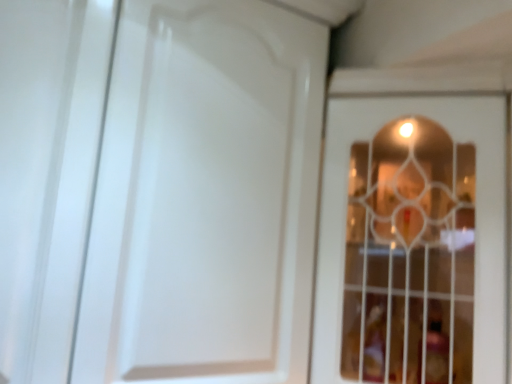
Question: In which direction should I rotate to look at white glossy door at center, the 1th door from the left?

Choices:
 (A) right
 (B) left

Answer: (B)

Question: Considering the relative sizes of white glossy door at center, which is the second door from right to left, and white glass door at center, the first door positioned from the right, in the image provided, is white glossy door at center, which is the second door from right to left, bigger than white glass door at center, the first door positioned from the right,?

Choices:
 (A) yes
 (B) no

Answer: (A)

Question: Is white glossy door at center, which is the second door from right to left, surrounding white glass door at center, the 2th door from the left?

Choices:
 (A) yes
 (B) no

Answer: (B)

Question: Is white glass door at center, the 2th door from the left, at the back of white glossy door at center, which is the second door from right to left?

Choices:
 (A) no
 (B) yes

Answer: (A)

Question: Is the position of white glossy door at center, the 1th door from the left, more distant than that of white glass door at center, the first door positioned from the right?

Choices:
 (A) yes
 (B) no

Answer: (A)

Question: From a real-world perspective, is white glossy door at center, which is the second door from right to left, over white glass door at center, the 2th door from the left?

Choices:
 (A) no
 (B) yes

Answer: (B)

Question: Is white glossy door at center, which is the second door from right to left, facing towards white glass door at center, the first door positioned from the right?

Choices:
 (A) no
 (B) yes

Answer: (A)

Question: Is white glass door at center, the 2th door from the left, in contact with white glossy door at center, which is the second door from right to left?

Choices:
 (A) no
 (B) yes

Answer: (A)

Question: Is white glass door at center, the 2th door from the left, bigger than white glossy door at center, which is the second door from right to left?

Choices:
 (A) no
 (B) yes

Answer: (A)

Question: From a real-world perspective, does white glass door at center, the 2th door from the left, stand above white glossy door at center, which is the second door from right to left?

Choices:
 (A) no
 (B) yes

Answer: (A)

Question: Is white glass door at center, the first door positioned from the right, facing away from white glossy door at center, the 1th door from the left?

Choices:
 (A) yes
 (B) no

Answer: (B)

Question: From the image's perspective, would you say white glass door at center, the first door positioned from the right, is shown under white glossy door at center, the 1th door from the left?

Choices:
 (A) yes
 (B) no

Answer: (A)

Question: Does white glass door at center, the 2th door from the left, have a lesser height compared to white glossy door at center, the 1th door from the left?

Choices:
 (A) no
 (B) yes

Answer: (B)

Question: In terms of width, does white glossy door at center, which is the second door from right to left, look wider or thinner when compared to white glass door at center, the 2th door from the left?

Choices:
 (A) wide
 (B) thin

Answer: (B)